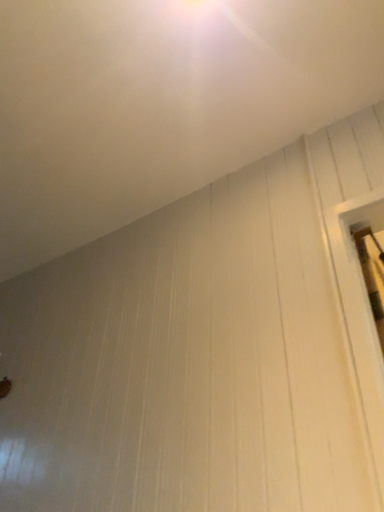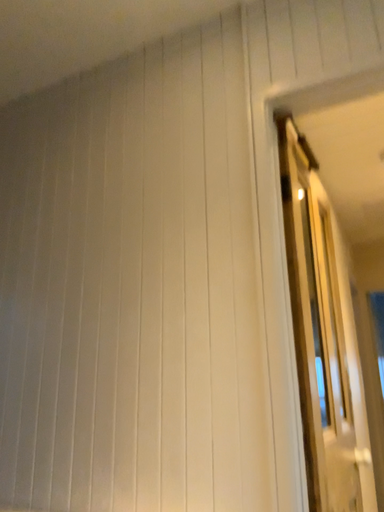
Question: Which way did the camera rotate in the video?

Choices:
 (A) rotated downward
 (B) rotated upward

Answer: (A)